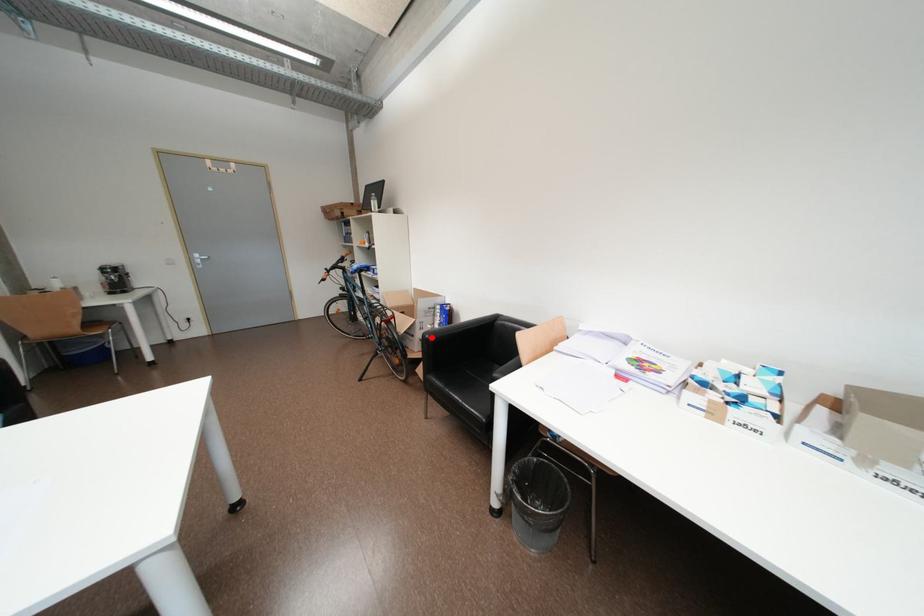
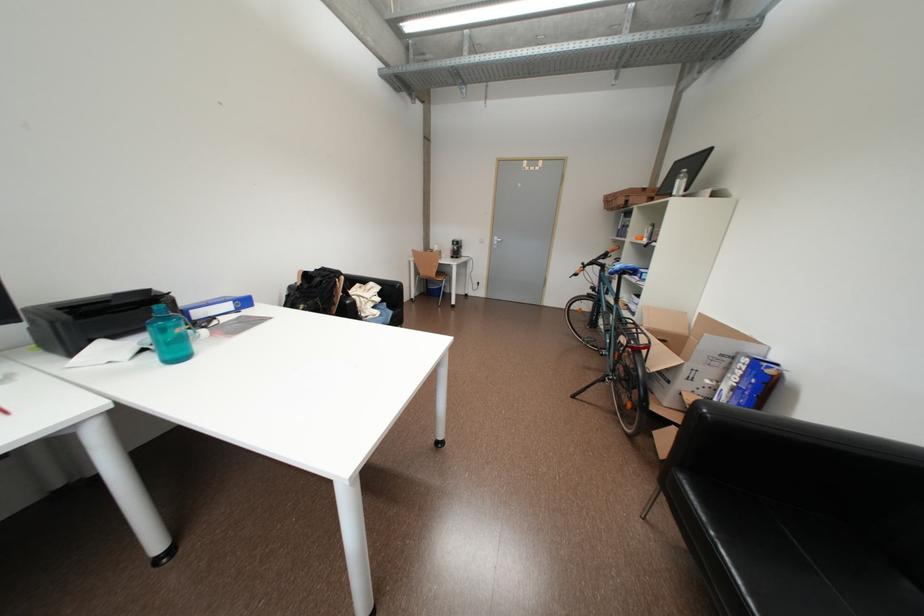
Question: A red point is marked in image1. In image2, is the corresponding 3D point closer to the camera or farther? Reply with the corresponding letter.

Choices:
 (A) The corresponding 3D point is closer.
 (B) The corresponding 3D point is farther.

Answer: (A)